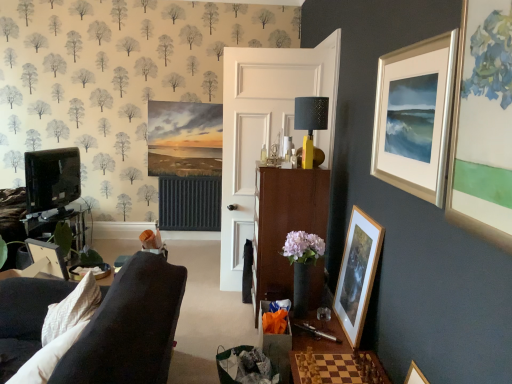
Question: Is yellow matte/black textured lampshade at center taller or shorter than matte black tv stand at left?

Choices:
 (A) short
 (B) tall

Answer: (A)

Question: From a real-world perspective, is yellow matte/black textured lampshade at center above or below matte black tv stand at left?

Choices:
 (A) above
 (B) below

Answer: (A)

Question: Which object is the closest to the wooden chessboard at lower center?

Choices:
 (A) yellow matte/black textured lampshade at center
 (B) wooden picture frame at left, which is the 1th picture frame in left-to-right order
 (C) matte black tv stand at left
 (D) silver metallic picture frame at upper right, the 1th picture frame viewed from the top
 (E) wooden picture frame at lower right, the second picture frame in the left-to-right sequence

Answer: (E)

Question: Which object is the farthest from the wooden chessboard at lower center?

Choices:
 (A) wooden picture frame at left, the 2th picture frame in the top-to-bottom sequence
 (B) wooden cabinet at center
 (C) yellow matte/black textured lampshade at center
 (D) silver metallic picture frame at upper right, which ranks as the 3th picture frame in bottom-to-top order
 (E) wooden picture frame at lower right, the second picture frame viewed from the right

Answer: (A)